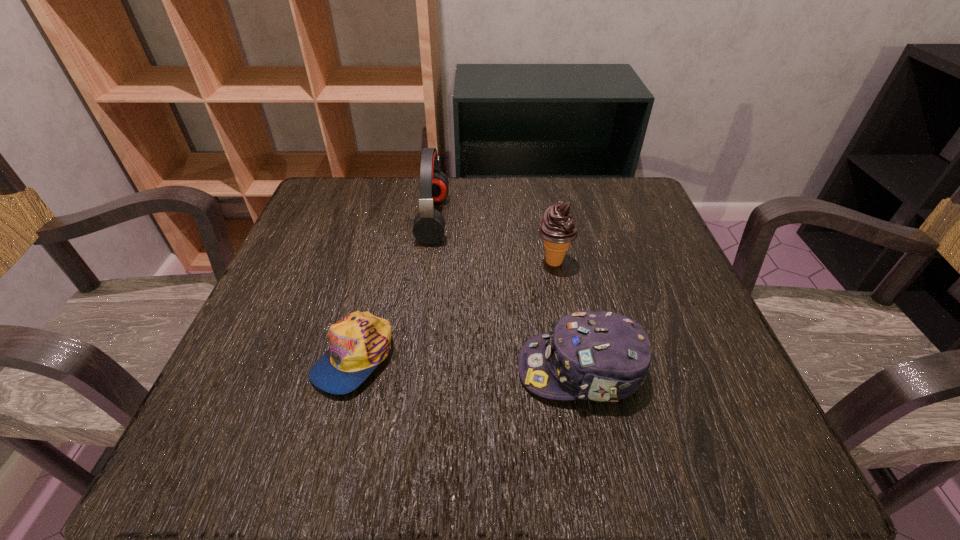
What are the coordinates of `vacant region between the icecream and the left cap` in the screenshot? It's located at (454, 309).

You are a GUI agent. You are given a task and a screenshot of the screen. Output one action in this format:
    pyautogui.click(x=<x>, y=<y>)
    Task: Click on the vacant space in between the third nearest object and the left cap
    
    Given the screenshot: What is the action you would take?
    pyautogui.click(x=454, y=309)

The width and height of the screenshot is (960, 540). Find the location of `object that is the nearest to the third object from right to left`. object that is the nearest to the third object from right to left is located at coordinates (558, 229).

Find the location of `object that is the closest to the left cap`. object that is the closest to the left cap is located at coordinates (601, 356).

Identify the location of vacant space that satisfies the following two spatial constraints: 1. on the ear cups of the second object from left to right; 2. on the bill of the shortest object. click(x=415, y=356).

Identify the location of blank area in the image that satisfies the following two spatial constraints: 1. on the ear cups of the earphone; 2. on the bill of the leftmost object. (x=415, y=356).

Find the location of a particular element. vacant space that satisfies the following two spatial constraints: 1. on the ear cups of the earphone; 2. on the bill of the shorter cap is located at coordinates (415, 356).

The image size is (960, 540). Identify the location of blank area in the image that satisfies the following two spatial constraints: 1. on the ear cups of the third object from right to left; 2. on the bill of the leftmost object. (415, 356).

Where is `vacant area in the image that satisfies the following two spatial constraints: 1. on the ear cups of the icecream; 2. on the left side of the second object from left to right`? vacant area in the image that satisfies the following two spatial constraints: 1. on the ear cups of the icecream; 2. on the left side of the second object from left to right is located at coordinates (427, 262).